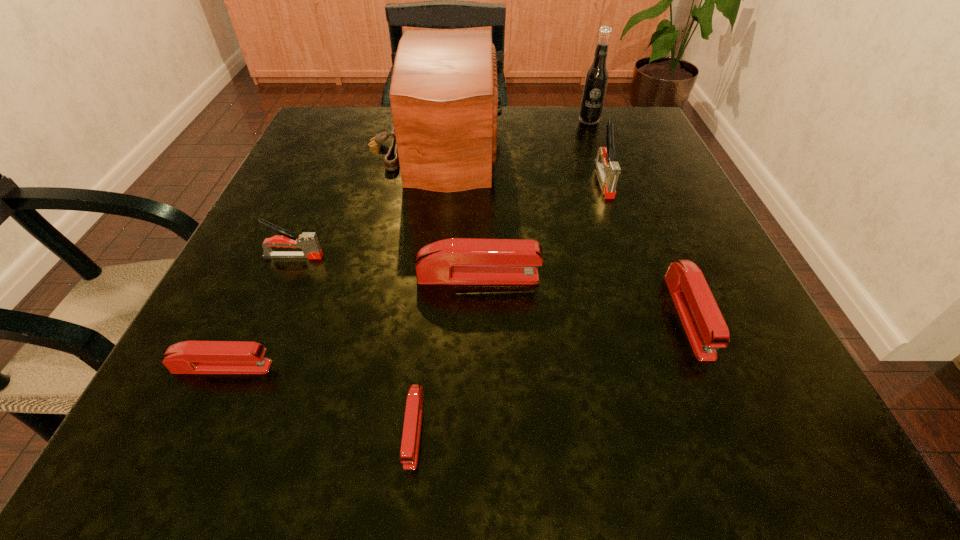
Where is `radio receiver at the far edge`? This screenshot has height=540, width=960. radio receiver at the far edge is located at coordinates (444, 98).

Locate an element on the screen. The height and width of the screenshot is (540, 960). root beer located in the far edge section of the desktop is located at coordinates (596, 79).

Where is `object that is at the near edge`? object that is at the near edge is located at coordinates (409, 451).

The image size is (960, 540). Find the location of `radio receiver that is at the left edge`. radio receiver that is at the left edge is located at coordinates point(444,98).

Locate an element on the screen. The image size is (960, 540). root beer that is at the right edge is located at coordinates (596, 79).

Where is `object present at the far left corner`? This screenshot has width=960, height=540. object present at the far left corner is located at coordinates (444, 98).

The height and width of the screenshot is (540, 960). What are the coordinates of `object at the far right corner` in the screenshot? It's located at (596, 79).

What are the coordinates of `vacant area at the far edge of the desktop` in the screenshot? It's located at (557, 128).

Image resolution: width=960 pixels, height=540 pixels. In the image, there is a desktop. In order to click on vacant region at the near edge in this screenshot , I will do `click(336, 418)`.

The height and width of the screenshot is (540, 960). Find the location of `vacant space at the left edge of the desktop`. vacant space at the left edge of the desktop is located at coordinates [x=329, y=218].